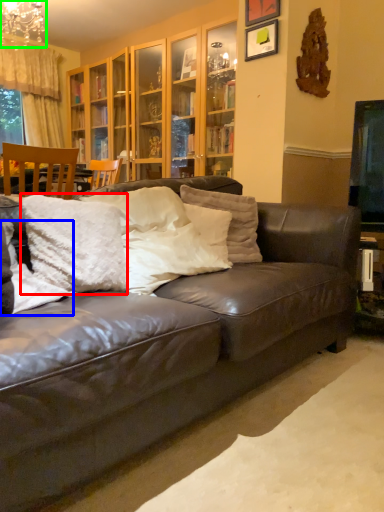
Question: Considering the real-world distances, which object is farthest from pillow (highlighted by a red box)? pillow (highlighted by a blue box) or chandelier (highlighted by a green box)?

Choices:
 (A) pillow
 (B) chandelier

Answer: (B)